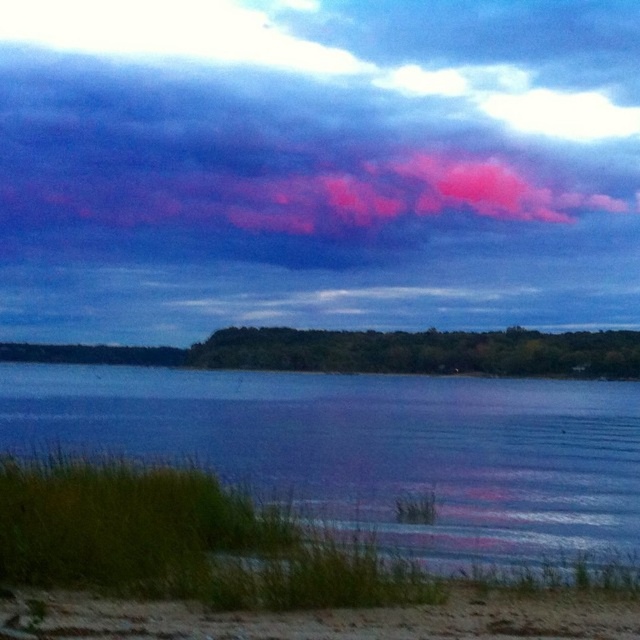
Between blue water at lower left and sandy at lower left, which one appears on the right side from the viewer's perspective?

blue water at lower left

Does point (196, 404) come in front of point (72, 636)?

No, it is not.

Locate an element on the screen. This screenshot has width=640, height=640. blue water at lower left is located at coordinates (369, 448).